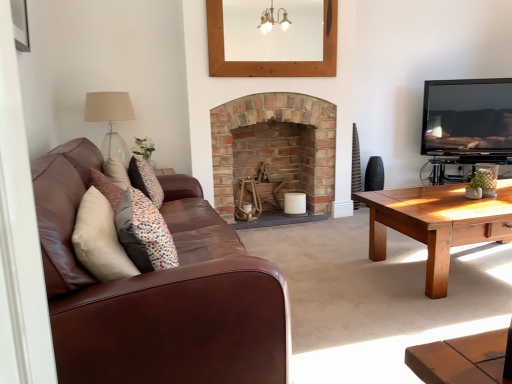
This screenshot has width=512, height=384. In order to click on brick fireplace at center in this screenshot , I will do `click(276, 121)`.

This screenshot has width=512, height=384. In order to click on black glossy tv at upper right in this screenshot , I will do `click(467, 117)`.

What do you see at coordinates (144, 233) in the screenshot? This screenshot has height=384, width=512. I see `multicolored fabric pillow at center` at bounding box center [144, 233].

Locate an element on the screen. beige fabric lampshade at upper left is located at coordinates (110, 120).

The height and width of the screenshot is (384, 512). Identify the location of brick fireplace at center. (276, 121).

Is brick fireplace at center further to camera compared to beige fabric lampshade at upper left?

Yes, it is.

Does brick fireplace at center have a smaller size compared to beige fabric lampshade at upper left?

No, brick fireplace at center is not smaller than beige fabric lampshade at upper left.

Which of these two, brick fireplace at center or beige fabric lampshade at upper left, stands shorter?

beige fabric lampshade at upper left.

Is brick fireplace at center turned away from beige fabric lampshade at upper left?

No, beige fabric lampshade at upper left is not at the back of brick fireplace at center.

Which object is closer to the camera, black glossy tv at upper right or beige fabric lampshade at upper left?

Positioned in front is beige fabric lampshade at upper left.

Can you confirm if black glossy tv at upper right is shorter than beige fabric lampshade at upper left?

No.

Does point (430, 154) come behind point (108, 116)?

That is True.

Considering the relative positions of beige fabric lampshade at upper left and black glossy tv at upper right in the image provided, is beige fabric lampshade at upper left to the right of black glossy tv at upper right from the viewer's perspective?

Incorrect, beige fabric lampshade at upper left is not on the right side of black glossy tv at upper right.

Looking at this image, from their relative heights in the image, would you say beige fabric lampshade at upper left is taller or shorter than black glossy tv at upper right?

Considering their sizes, beige fabric lampshade at upper left has less height than black glossy tv at upper right.

Is beige fabric lampshade at upper left situated inside black glossy tv at upper right or outside?

beige fabric lampshade at upper left is outside black glossy tv at upper right.

Is point (114, 143) more distant than point (497, 126)?

No, it is not.

Would you say wooden picture frame at upper center is to the left or to the right of multicolored fabric pillow at center in the picture?

wooden picture frame at upper center is to the right of multicolored fabric pillow at center.

From a real-world perspective, who is located lower, wooden picture frame at upper center or multicolored fabric pillow at center?

multicolored fabric pillow at center is physically lower.

Considering their positions, is wooden picture frame at upper center located in front of or behind multicolored fabric pillow at center?

Visually, wooden picture frame at upper center is located behind multicolored fabric pillow at center.

How many degrees apart are the facing directions of wooden picture frame at upper center and multicolored fabric pillow at center?

They differ by 91.9 degrees in their facing directions.

Is the position of brown leather couch at left more distant than that of wooden picture frame at upper center?

No, brown leather couch at left is closer to the viewer.

Is brown leather couch at left positioned far away from wooden picture frame at upper center?

Yes, brown leather couch at left and wooden picture frame at upper center are quite far apart.

Considering the relative sizes of brown leather couch at left and wooden picture frame at upper center in the image provided, is brown leather couch at left wider than wooden picture frame at upper center?

Yes, brown leather couch at left is wider than wooden picture frame at upper center.

From a real-world perspective, is brown leather couch at left positioned above or below wooden picture frame at upper center?

In terms of real-world spatial position, brown leather couch at left is below wooden picture frame at upper center.

Is the position of brown leather couch at left more distant than that of black glossy tv at upper right?

No, brown leather couch at left is closer to the camera.

Looking at this image, can you confirm if brown leather couch at left is smaller than black glossy tv at upper right?

Actually, brown leather couch at left might be larger than black glossy tv at upper right.

Choose the correct answer: Is brown leather couch at left inside black glossy tv at upper right or outside it?

brown leather couch at left is spatially situated outside black glossy tv at upper right.

Is black glossy tv at upper right positioned beyond the bounds of brown leather couch at left?

Yes.

Could you tell me if black glossy tv at upper right is turned towards brown leather couch at left?

No, black glossy tv at upper right is not oriented towards brown leather couch at left.

From the image's perspective, between black glossy tv at upper right and brown leather couch at left, which one is located above?

From the image's view, black glossy tv at upper right is above.

Between black glossy tv at upper right and brown leather couch at left, which one has smaller size?

black glossy tv at upper right.

Find the location of `lamp on the left of brick fireplace at center`. lamp on the left of brick fireplace at center is located at coordinates [110, 120].

Locate an element on the screen. Image resolution: width=512 pixels, height=384 pixels. television on the right of the beige fabric lampshade at upper left is located at coordinates (467, 117).

When comparing their distances from black glossy tv at upper right, does multicolored fabric pillow at center or brick fireplace at center seem closer?

brick fireplace at center is closer to black glossy tv at upper right.

Considering their positions, is brown leather couch at left positioned further to black glossy tv at upper right than beige fabric lampshade at upper left?

brown leather couch at left.

Based on their spatial positions, is wooden picture frame at upper center or black glossy tv at upper right closer to brown leather couch at left?

wooden picture frame at upper center lies closer to brown leather couch at left than the other object.

Which object lies further to the anchor point wooden picture frame at upper center, brick fireplace at center or beige fabric lampshade at upper left?

beige fabric lampshade at upper left is further to wooden picture frame at upper center.

Looking at the image, which one is located further to beige fabric lampshade at upper left, wooden picture frame at upper center or multicolored fabric pillow at center?

The object further to beige fabric lampshade at upper left is multicolored fabric pillow at center.

Considering their positions, is multicolored fabric pillow at center positioned further to beige fabric lampshade at upper left than black glossy tv at upper right?

black glossy tv at upper right lies further to beige fabric lampshade at upper left than the other object.

From the image, which object appears to be farther from beige fabric lampshade at upper left, black glossy tv at upper right or wooden picture frame at upper center?

black glossy tv at upper right is positioned further to the anchor beige fabric lampshade at upper left.

When comparing their distances from multicolored fabric pillow at center, does black glossy tv at upper right or wooden picture frame at upper center seem further?

Among the two, black glossy tv at upper right is located further to multicolored fabric pillow at center.

The width and height of the screenshot is (512, 384). In order to click on lamp located between brown leather couch at left and wooden picture frame at upper center in the depth direction in this screenshot , I will do `click(110, 120)`.

Where is `picture frame between brown leather couch at left and brick fireplace at center along the z-axis`? This screenshot has height=384, width=512. picture frame between brown leather couch at left and brick fireplace at center along the z-axis is located at coordinates (269, 62).

Where is `pillow between beige fabric lampshade at upper left and black glossy tv at upper right in the horizontal direction`? This screenshot has width=512, height=384. pillow between beige fabric lampshade at upper left and black glossy tv at upper right in the horizontal direction is located at coordinates (144, 233).

This screenshot has width=512, height=384. Find the location of `picture frame between multicolored fabric pillow at center and black glossy tv at upper right in the front-back direction`. picture frame between multicolored fabric pillow at center and black glossy tv at upper right in the front-back direction is located at coordinates (269, 62).